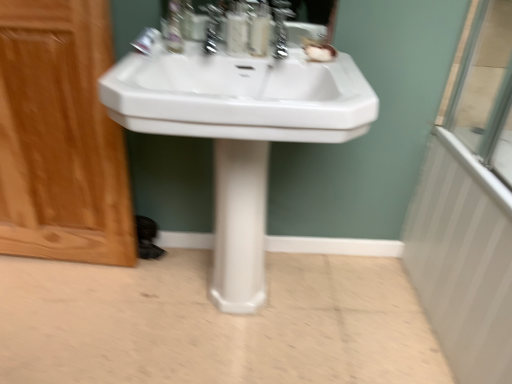
Locate an element on the screen. free space to the left of white glossy pedestal at center is located at coordinates (184, 286).